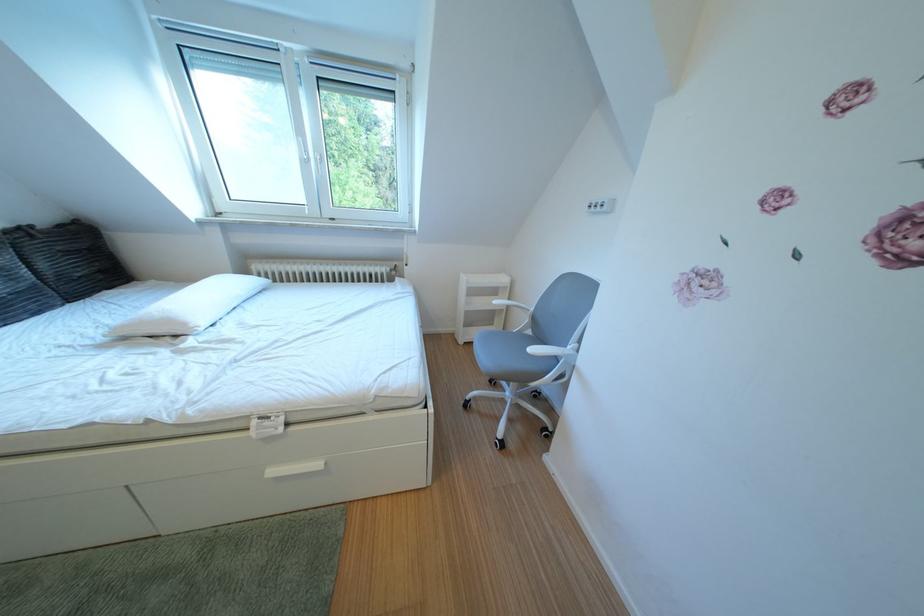
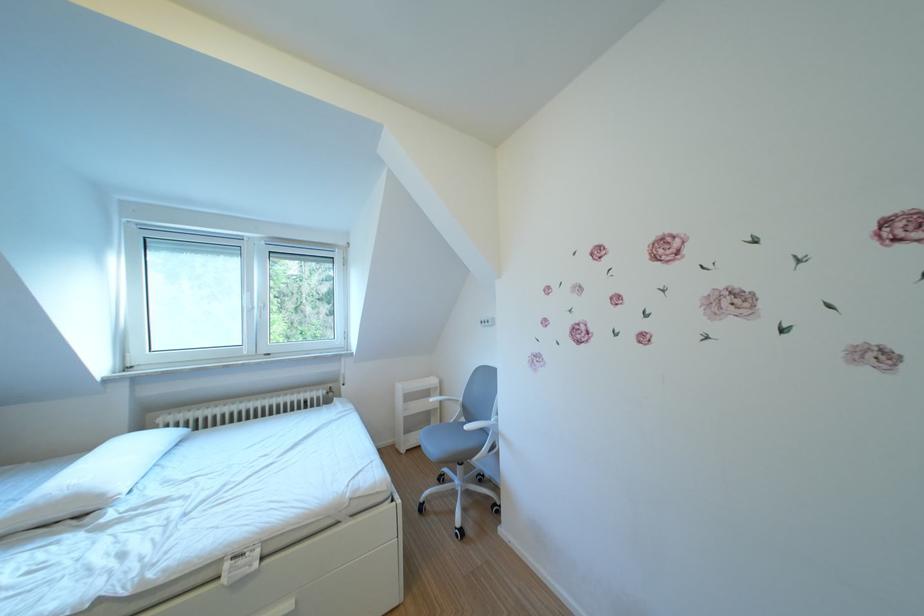
The point at (481, 330) is marked in the first image. Where is the corresponding point in the second image?

(420, 437)